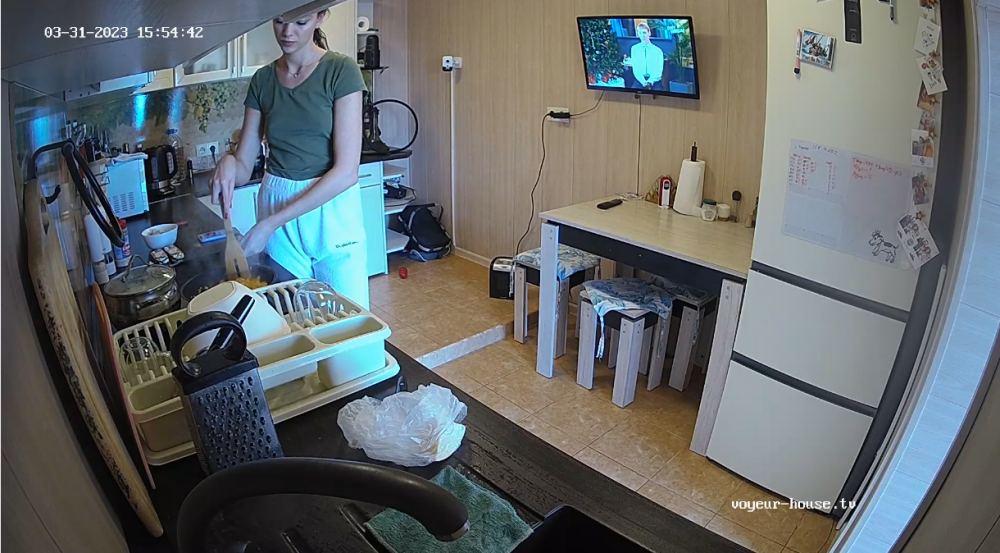
Find the location of `light brown tiled floor`. light brown tiled floor is located at coordinates (575, 419).